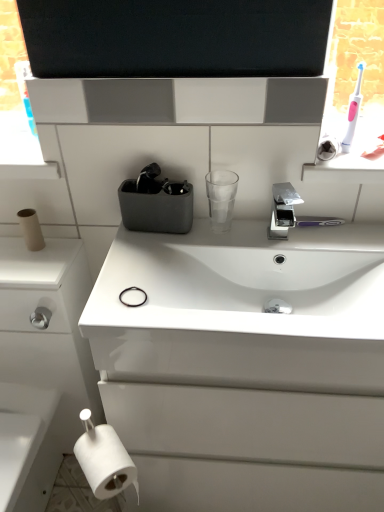
The width and height of the screenshot is (384, 512). Find the location of `vacant space situated on the left part of chrome metallic faucet at center`. vacant space situated on the left part of chrome metallic faucet at center is located at coordinates (220, 242).